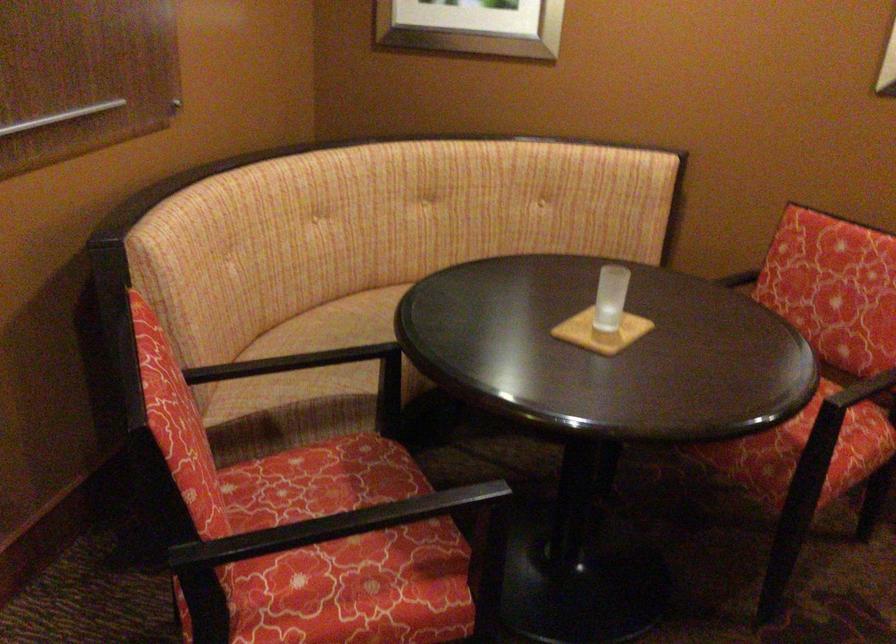
The location [600,332] corresponds to which object?

It refers to a square coaster.